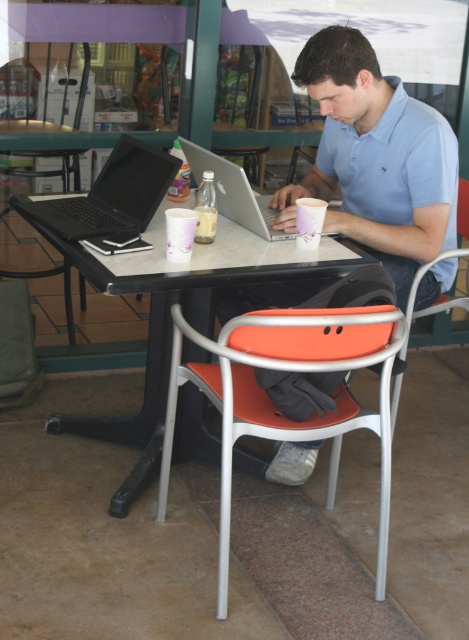
Question: Can you confirm if light blue cotton shirt at upper center is wider than orange matte chair at center?

Choices:
 (A) yes
 (B) no

Answer: (B)

Question: Among these points, which one is farthest from the camera?

Choices:
 (A) (231, 220)
 (B) (400, 241)

Answer: (A)

Question: Which of the following is the farthest from the observer?

Choices:
 (A) silver metallic laptop at center
 (B) orange matte chair at center
 (C) white paper cup at upper center
 (D) white paper cup at center

Answer: (D)

Question: In this image, where is light blue cotton shirt at upper center located relative to orange matte chair at center?

Choices:
 (A) below
 (B) above

Answer: (B)

Question: Which point is closer to the camera?

Choices:
 (A) (252, 225)
 (B) (211, 189)
 (C) (254, 460)

Answer: (B)

Question: Can you confirm if light blue cotton shirt at upper center is thinner than matte black laptop at left?

Choices:
 (A) no
 (B) yes

Answer: (A)